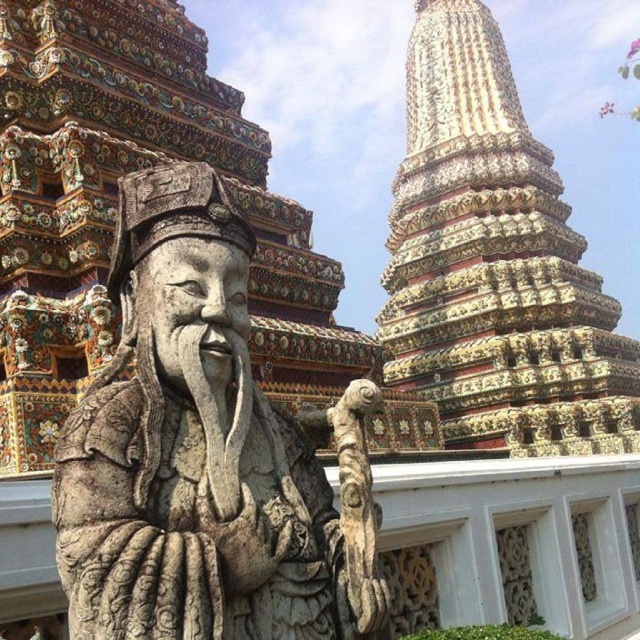
Question: Which of the following is the farthest from the observer?

Choices:
 (A) (164, 627)
 (B) (604, 442)

Answer: (B)

Question: Does stone statue at center have a lesser width compared to carved stone tower at upper right?

Choices:
 (A) no
 (B) yes

Answer: (B)

Question: Among these points, which one is farthest from the camera?

Choices:
 (A) (428, 84)
 (B) (140, 541)

Answer: (A)

Question: Is stone statue at center to the right of carved stone tower at upper right from the viewer's perspective?

Choices:
 (A) no
 (B) yes

Answer: (A)

Question: Is stone statue at center bigger than carved stone tower at upper right?

Choices:
 (A) no
 (B) yes

Answer: (A)